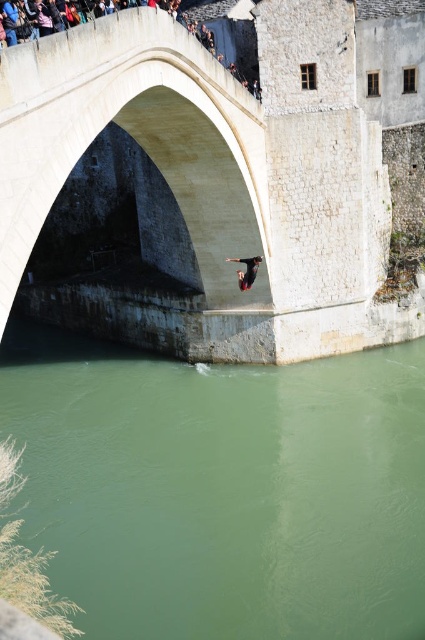
Question: Does white stone arch bridge at center appear under black matte skateboard at center?

Choices:
 (A) yes
 (B) no

Answer: (B)

Question: Which of the following is the closest to the observer?

Choices:
 (A) (167, 561)
 (B) (127, 122)
 (C) (257, 262)

Answer: (A)

Question: Among these points, which one is farthest from the camera?

Choices:
 (A) (125, 403)
 (B) (240, 289)
 (C) (104, 33)

Answer: (A)

Question: Does white stone arch bridge at center have a greater width compared to black matte skateboard at center?

Choices:
 (A) yes
 (B) no

Answer: (A)

Question: Which of the following is the closest to the observer?

Choices:
 (A) (153, 364)
 (B) (217, 61)
 (C) (243, 276)

Answer: (B)

Question: Is green smooth water at center below white stone arch bridge at center?

Choices:
 (A) yes
 (B) no

Answer: (A)